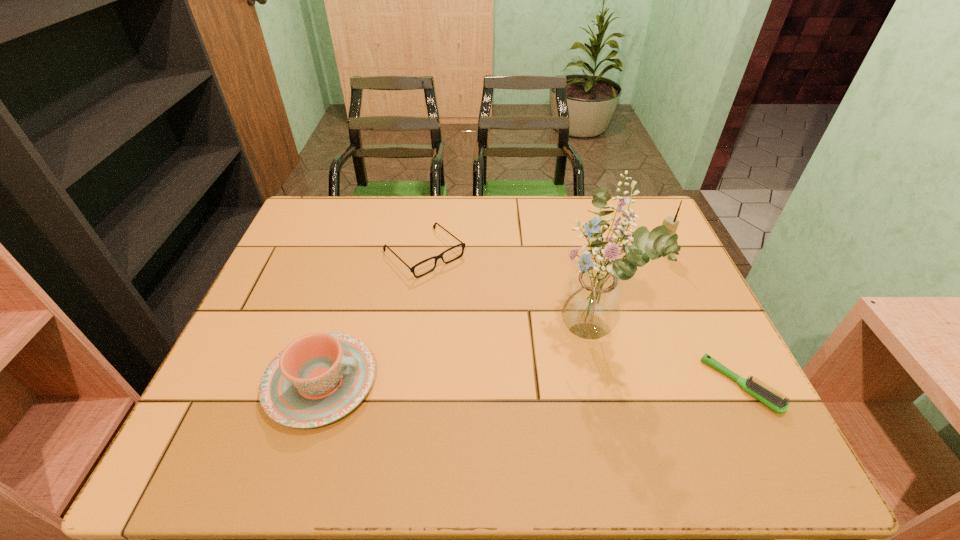
Where is `the second closest object relative to the tallest object`? This screenshot has width=960, height=540. the second closest object relative to the tallest object is located at coordinates (671, 223).

Select which object is the closest to the tallest object. Please provide its 2D coordinates. Your answer should be formatted as a tuple, i.e. [(x, y)], where the tuple contains the x and y coordinates of a point satisfying the conditions above.

[(772, 400)]

Identify the location of vacant space that satisfies the following two spatial constraints: 1. on the front side of the spectacles; 2. on the right side of the shortest object. Image resolution: width=960 pixels, height=540 pixels. point(405,385).

Where is `free region that satisfies the following two spatial constraints: 1. on the front side of the spectacles; 2. on the left side of the shortest object`? The width and height of the screenshot is (960, 540). free region that satisfies the following two spatial constraints: 1. on the front side of the spectacles; 2. on the left side of the shortest object is located at coordinates (405, 385).